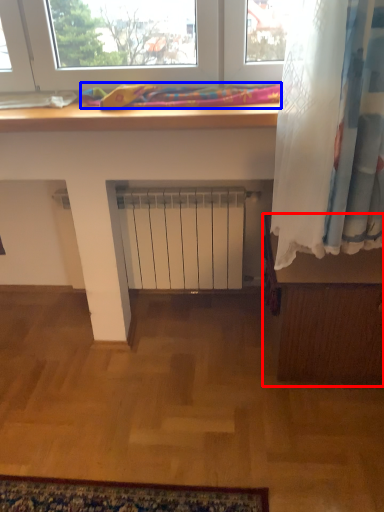
Question: Which of the following is the farthest to the observer, furniture (highlighted by a red box) or bedding (highlighted by a blue box)?

Choices:
 (A) furniture
 (B) bedding

Answer: (A)